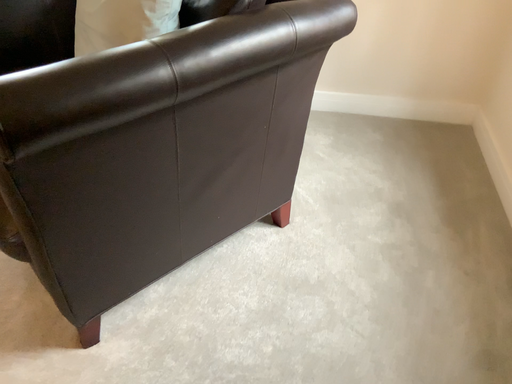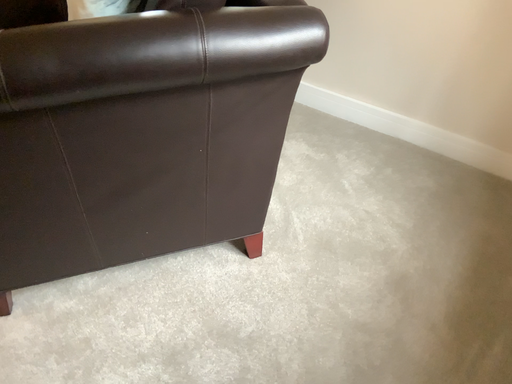
Question: How did the camera likely rotate when shooting the video?

Choices:
 (A) rotated right
 (B) rotated left

Answer: (B)